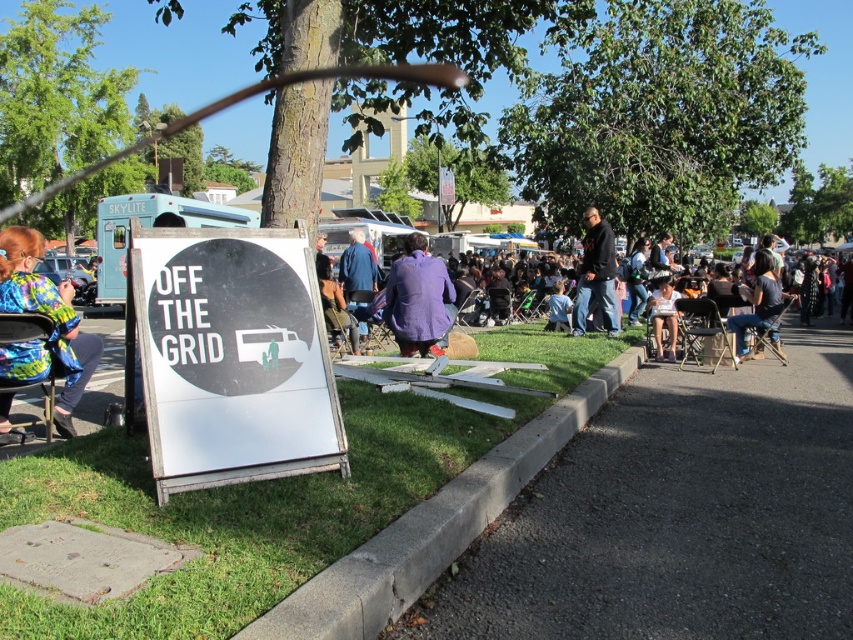
Question: Does gray concrete curb at lower center have a lesser width compared to black matte jacket at upper center?

Choices:
 (A) no
 (B) yes

Answer: (A)

Question: Among these points, which one is farthest from the camera?

Choices:
 (A) (144, 310)
 (B) (773, 275)
 (C) (358, 586)
 (D) (585, 282)

Answer: (D)

Question: Which point is closer to the camera?

Choices:
 (A) purple fabric jacket at center
 (B) purple wool coat at center

Answer: (A)

Question: Among these objects, which one is nearest to the camera?

Choices:
 (A) purple wool coat at center
 (B) gray concrete curb at lower center

Answer: (B)

Question: Does multicolored fabric jacket at left have a larger size compared to purple fabric jacket at center?

Choices:
 (A) yes
 (B) no

Answer: (B)

Question: Is white wood sign at lower left wider than purple fabric jacket at center?

Choices:
 (A) no
 (B) yes

Answer: (A)